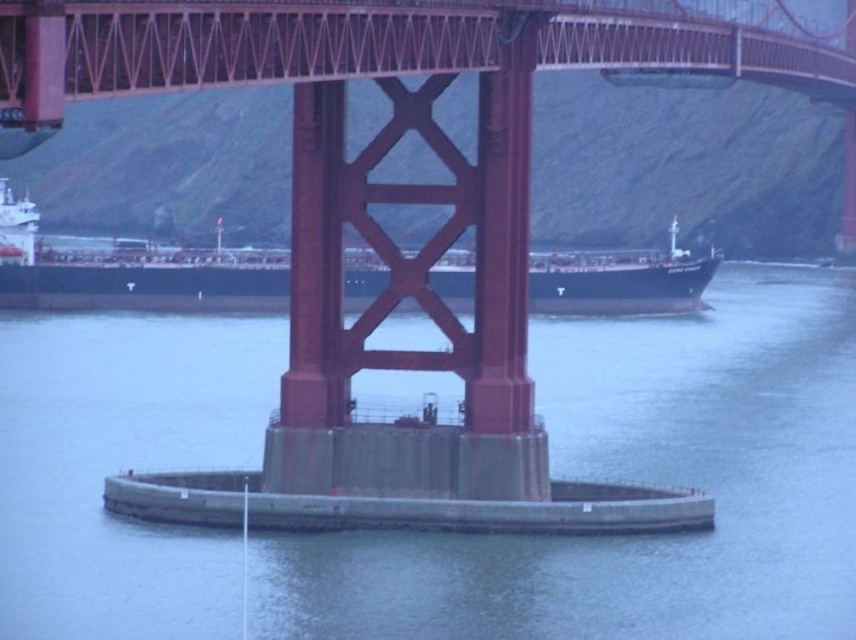
Can you confirm if gray concrete water at center is wider than black matte ship at center?

Yes, gray concrete water at center is wider than black matte ship at center.

Does gray concrete water at center appear on the right side of black matte ship at center?

No, gray concrete water at center is not to the right of black matte ship at center.

What do you see at coordinates (635, 481) in the screenshot? I see `gray concrete water at center` at bounding box center [635, 481].

Locate an element on the screen. This screenshot has width=856, height=640. gray concrete water at center is located at coordinates (635, 481).